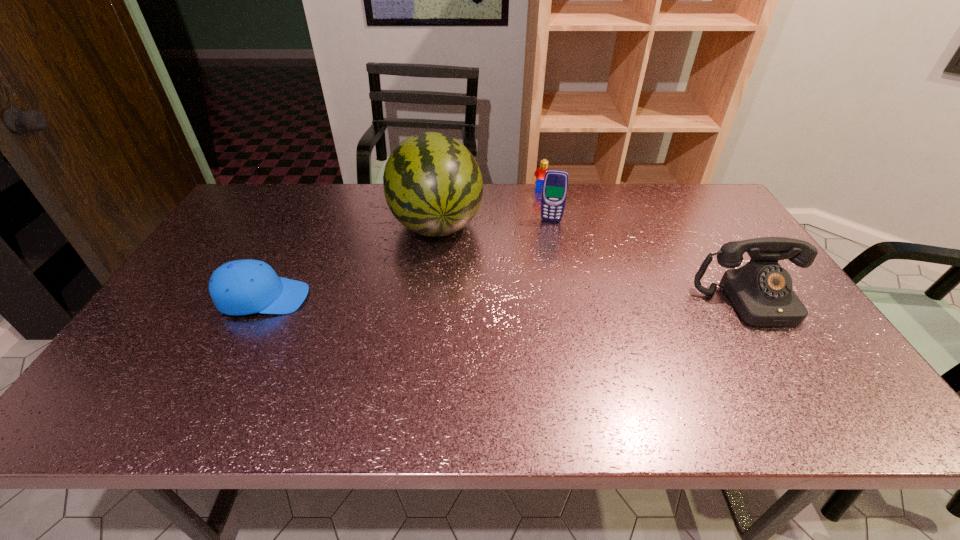
Locate an element on the screen. This screenshot has width=960, height=540. free point located 0.080m on the front-facing side of the farthest object is located at coordinates (535, 204).

Identify the location of free location located at the stem end of the watermelon. (454, 296).

You are a GUI agent. You are given a task and a screenshot of the screen. Output one action in this format:
    pyautogui.click(x=<x>, y=<y>)
    Task: Click on the vacant space located at the stem end of the watermelon
    This screenshot has width=960, height=540.
    Given the screenshot: What is the action you would take?
    pyautogui.click(x=450, y=281)

Locate an element on the screen. The height and width of the screenshot is (540, 960). vacant space located 0.380m at the stem end of the watermelon is located at coordinates (471, 359).

Find the location of a particular element. This screenshot has width=960, height=540. free space located on the front-facing side of the cellular telephone is located at coordinates (540, 296).

At what (x,y) coordinates should I click in order to perform the action: click on vacant space located 0.080m on the front-facing side of the cellular telephone. Please return your answer as a coordinate pair (x, y). The height and width of the screenshot is (540, 960). Looking at the image, I should click on (547, 238).

The image size is (960, 540). What are the coordinates of `vacant space located on the front-facing side of the cellular telephone` in the screenshot? It's located at (545, 254).

I want to click on Lego present at the far edge, so click(540, 173).

Where is `watermelon present at the far edge`? watermelon present at the far edge is located at coordinates (433, 186).

The image size is (960, 540). In order to click on cellular telephone located in the far edge section of the desktop in this screenshot , I will do `click(555, 185)`.